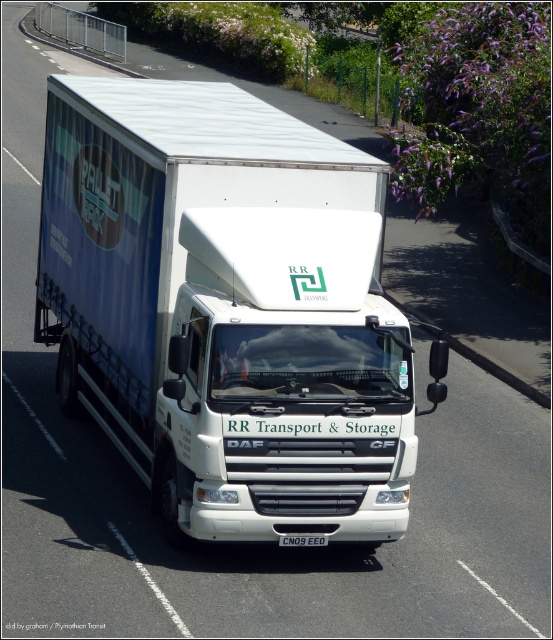
Question: Where is white matte truck at center located in relation to black plastic license plate at center in the image?

Choices:
 (A) above
 (B) below

Answer: (A)

Question: Is white matte truck at center above black plastic license plate at center?

Choices:
 (A) no
 (B) yes

Answer: (B)

Question: Which of the following is the closest to the observer?

Choices:
 (A) black plastic license plate at center
 (B) white matte truck at center

Answer: (B)

Question: Is white matte truck at center further to camera compared to black plastic license plate at center?

Choices:
 (A) yes
 (B) no

Answer: (B)